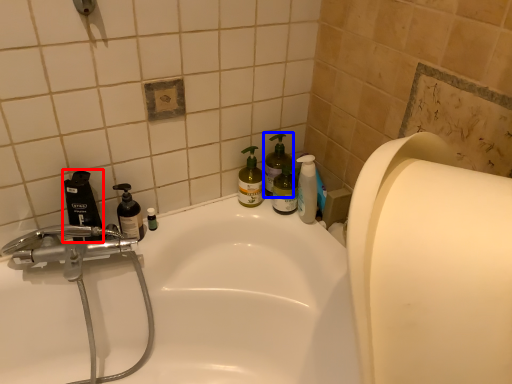
Question: Which object is closer to the camera taking this photo, mouthwash (highlighted by a red box) or cleaning product (highlighted by a blue box)?

Choices:
 (A) mouthwash
 (B) cleaning product

Answer: (A)